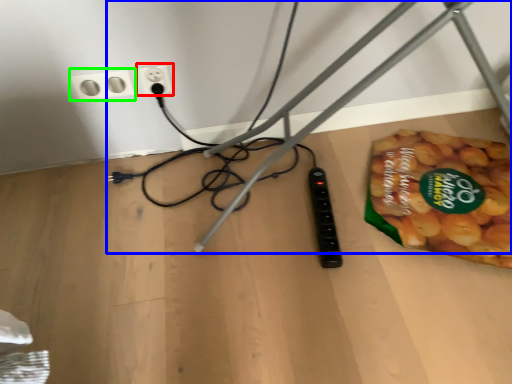
Question: Which is nearer to the power plugs and sockets (highlighted by a red box)? wire (highlighted by a blue box) or power plugs and sockets (highlighted by a green box).

Choices:
 (A) wire
 (B) power plugs and sockets

Answer: (B)